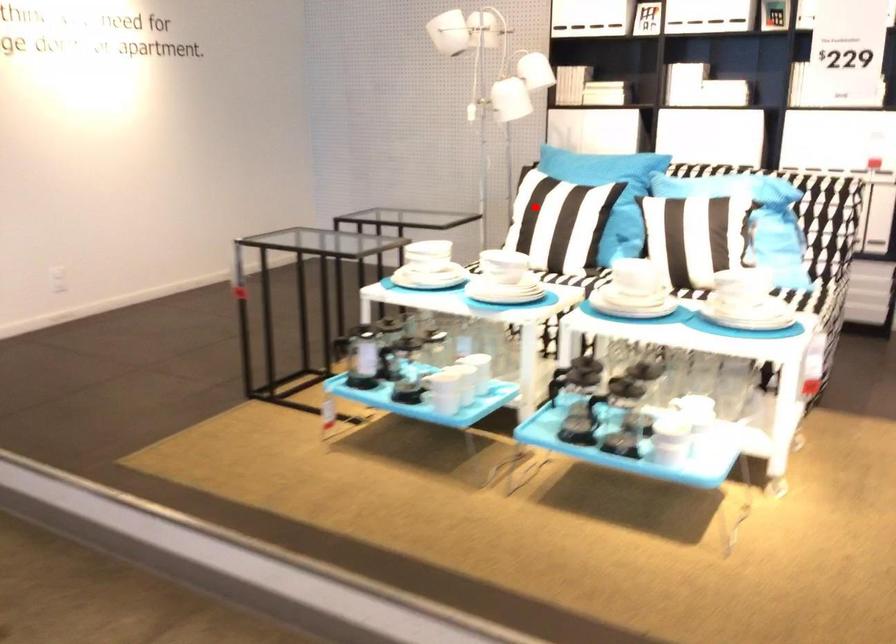
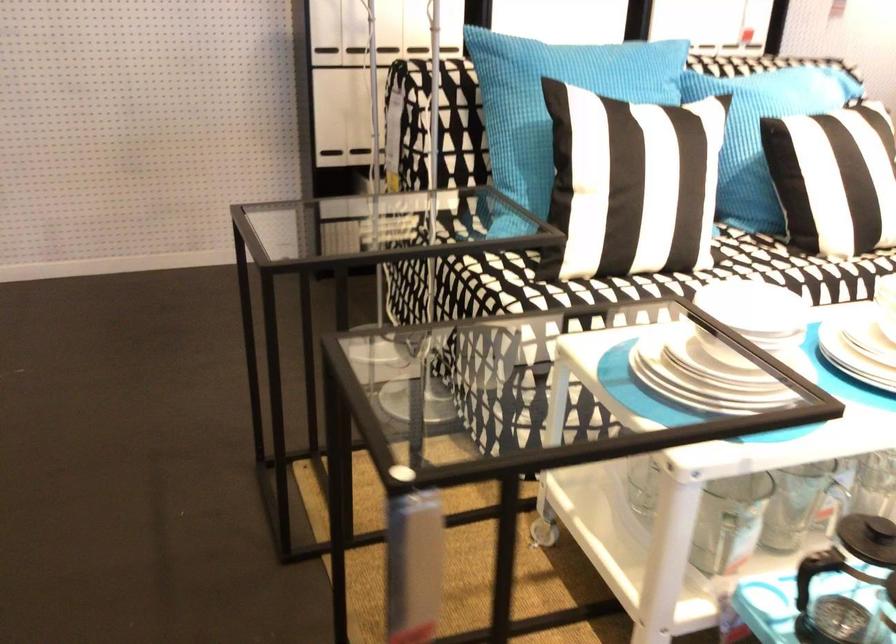
Question: A red point is marked in image1. In image2, is the corresponding 3D point closer to the camera or farther? Reply with the corresponding letter.

Choices:
 (A) The corresponding 3D point is closer.
 (B) The corresponding 3D point is farther.

Answer: (A)